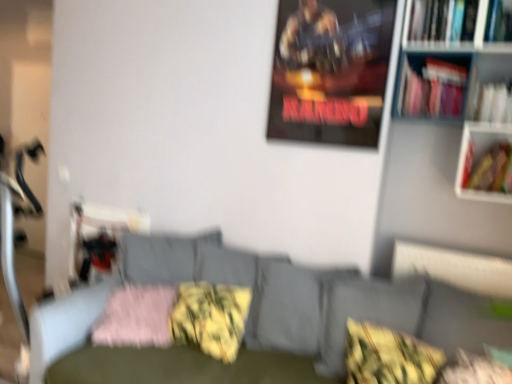
Question: Is pink fluffy pillow at lower left, arranged as the 4th pillow when viewed from the right, looking in the opposite direction of textured gray couch at center?

Choices:
 (A) no
 (B) yes

Answer: (B)

Question: Considering the relative sizes of pink fluffy pillow at lower left, arranged as the 4th pillow when viewed from the right, and textured gray couch at center in the image provided, is pink fluffy pillow at lower left, arranged as the 4th pillow when viewed from the right, smaller than textured gray couch at center?

Choices:
 (A) no
 (B) yes

Answer: (B)

Question: From a real-world perspective, is pink fluffy pillow at lower left, arranged as the 4th pillow when viewed from the right, on textured gray couch at center?

Choices:
 (A) yes
 (B) no

Answer: (A)

Question: Are pink fluffy pillow at lower left, the first pillow viewed from the left, and textured gray couch at center far apart?

Choices:
 (A) yes
 (B) no

Answer: (B)

Question: Considering the relative sizes of pink fluffy pillow at lower left, the first pillow viewed from the left, and textured gray couch at center in the image provided, is pink fluffy pillow at lower left, the first pillow viewed from the left, thinner than textured gray couch at center?

Choices:
 (A) no
 (B) yes

Answer: (B)

Question: From the image's perspective, relative to black leather swivel chair at center, is hardcover book at right, placed as the 1th book when sorted from bottom to top, above or below?

Choices:
 (A) below
 (B) above

Answer: (B)

Question: From a real-world perspective, is hardcover book at right, placed as the 1th book when sorted from bottom to top, above or below black leather swivel chair at center?

Choices:
 (A) below
 (B) above

Answer: (B)

Question: Is hardcover book at right, placed as the 1th book when sorted from bottom to top, wider or thinner than black leather swivel chair at center?

Choices:
 (A) wide
 (B) thin

Answer: (A)

Question: Is hardcover book at right, placed as the 1th book when sorted from bottom to top, in front of or behind black leather swivel chair at center in the image?

Choices:
 (A) behind
 (B) front

Answer: (B)

Question: Choose the correct answer: Is pink fluffy pillow at lower left, the first pillow viewed from the left, inside yellow-green textured pillow at center, which is the second pillow from right to left, or outside it?

Choices:
 (A) outside
 (B) inside

Answer: (A)

Question: In the image, is pink fluffy pillow at lower left, arranged as the 4th pillow when viewed from the right, positioned in front of or behind yellow-green textured pillow at center, the third pillow when ordered from left to right?

Choices:
 (A) front
 (B) behind

Answer: (B)

Question: In terms of size, does pink fluffy pillow at lower left, the first pillow viewed from the left, appear bigger or smaller than yellow-green textured pillow at center, which is the second pillow from right to left?

Choices:
 (A) big
 (B) small

Answer: (B)

Question: From a real-world perspective, is pink fluffy pillow at lower left, arranged as the 4th pillow when viewed from the right, above or below yellow-green textured pillow at center, which is the second pillow from right to left?

Choices:
 (A) below
 (B) above

Answer: (A)

Question: From a real-world perspective, is textured gray couch at center above or below yellow-green textured pillow at center, which is the second pillow from right to left?

Choices:
 (A) above
 (B) below

Answer: (B)

Question: Considering their positions, is textured gray couch at center located in front of or behind yellow-green textured pillow at center, which is the second pillow from right to left?

Choices:
 (A) front
 (B) behind

Answer: (A)